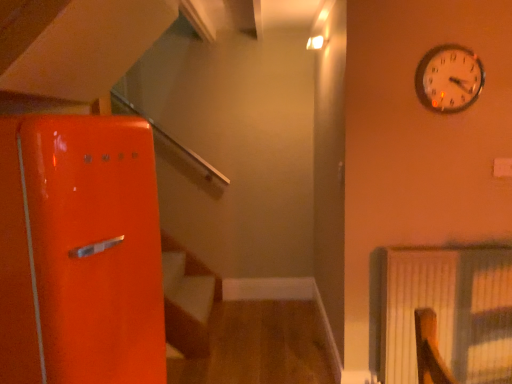
Question: From the image's perspective, is metallic silver clock at upper right located beneath white textured radiator at right?

Choices:
 (A) no
 (B) yes

Answer: (A)

Question: Is metallic silver clock at upper right at the left side of white textured radiator at right?

Choices:
 (A) yes
 (B) no

Answer: (A)

Question: Is metallic silver clock at upper right touching white textured radiator at right?

Choices:
 (A) yes
 (B) no

Answer: (B)

Question: Does metallic silver clock at upper right come in front of white textured radiator at right?

Choices:
 (A) yes
 (B) no

Answer: (A)

Question: Does metallic silver clock at upper right have a greater height compared to white textured radiator at right?

Choices:
 (A) no
 (B) yes

Answer: (A)

Question: Is metallic silver clock at upper right facing away from white textured radiator at right?

Choices:
 (A) yes
 (B) no

Answer: (B)

Question: Can you confirm if white textured radiator at right is shorter than metallic silver clock at upper right?

Choices:
 (A) yes
 (B) no

Answer: (B)

Question: From a real-world perspective, is white textured radiator at right located higher than metallic silver clock at upper right?

Choices:
 (A) no
 (B) yes

Answer: (A)

Question: Can you confirm if white textured radiator at right is bigger than metallic silver clock at upper right?

Choices:
 (A) no
 (B) yes

Answer: (B)

Question: From the image's perspective, is white textured radiator at right located above metallic silver clock at upper right?

Choices:
 (A) no
 (B) yes

Answer: (A)

Question: Is white textured radiator at right at the right side of metallic silver clock at upper right?

Choices:
 (A) yes
 (B) no

Answer: (A)

Question: Is white textured radiator at right at the left side of metallic silver clock at upper right?

Choices:
 (A) yes
 (B) no

Answer: (B)

Question: Based on their sizes in the image, would you say white textured radiator at right is bigger or smaller than metallic silver clock at upper right?

Choices:
 (A) small
 (B) big

Answer: (B)